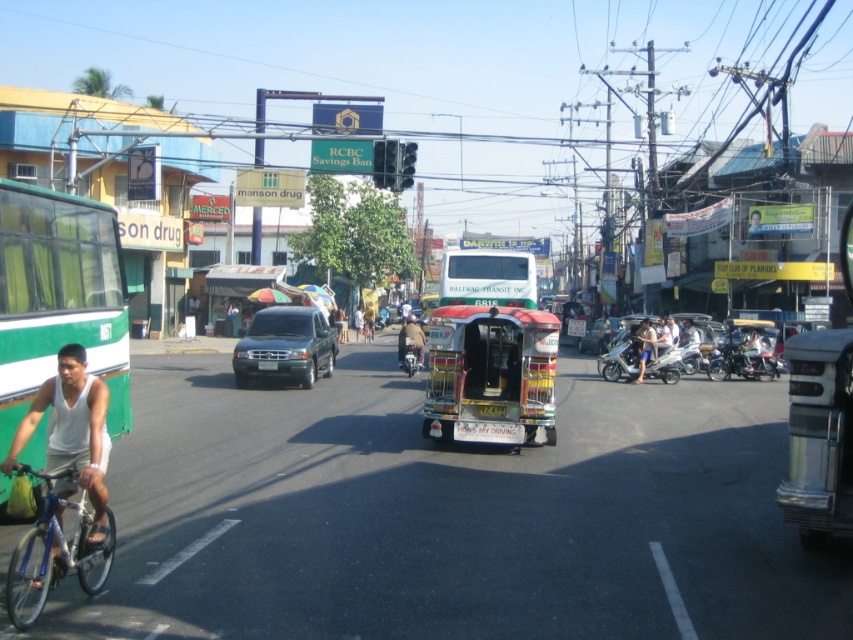
You are a delivery driver navigating through the busy street scene. You need to pass the green matte bus at left. Based on its position, which direction should you steer your vehicle to avoid collision?

The green matte bus at left is located at coordinates approximately 0.467 along the x axis and 0.069 along the y axis, so you should steer your vehicle to the right to avoid collision with the green matte bus at left.

Looking at this image, you are a pedestrian standing on the sidewalk and see the metallic red and yellow tricycle at center and the white fabric shirt at lower left. Which object is closer to you?

The metallic red and yellow tricycle at center is closer to you because it is further to the viewer than the white fabric shirt at lower left.

You are a pedestrian standing at the crosswalk near the metallic red and yellow tricycle at center and the white fabric shirt at lower left. Which object is closer to your right side?

The metallic red and yellow tricycle at center is to the right of the white fabric shirt at lower left, so the metallic red and yellow tricycle at center is closer to your right side.